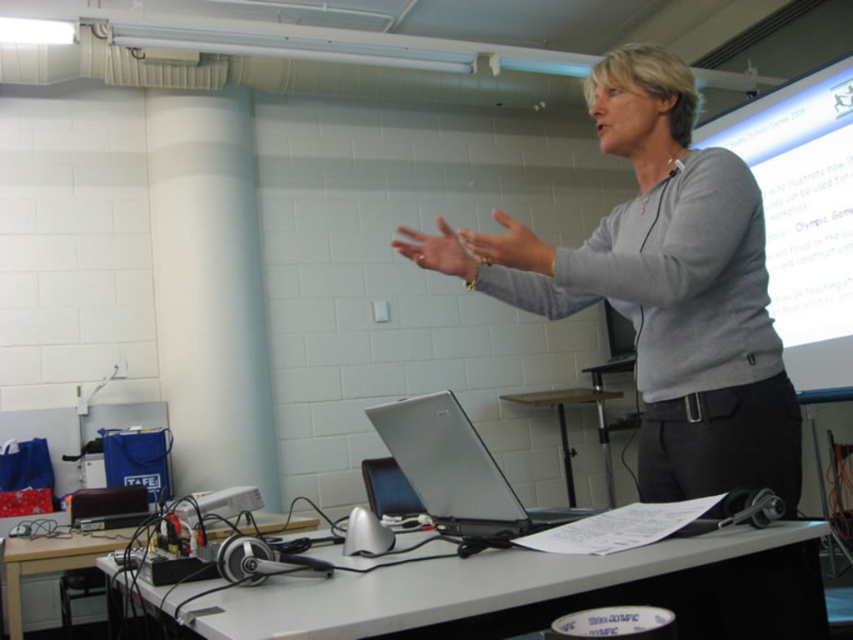
You are a student sitting in the classroom. You need to place your notebook on the gray matte sweater at center and the white plastic table at center. Which object can you place your notebook on without it falling off?

The gray matte sweater at center is bigger than the white plastic table at center, so placing the notebook on the gray matte sweater at center would be more stable and less likely to fall off.